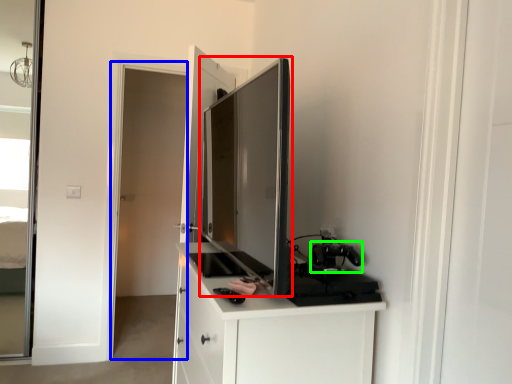
Question: Which object is positioned closest to appliance (highlighted by a red box)? Select from screen door (highlighted by a blue box) and appliance (highlighted by a green box).

Choices:
 (A) screen door
 (B) appliance

Answer: (B)